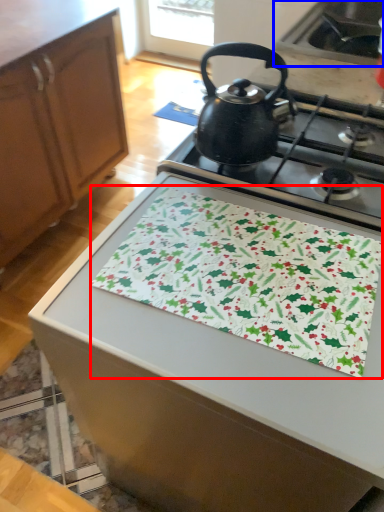
Question: Which point is further to the camera, blanket (highlighted by a red box) or sink (highlighted by a blue box)?

Choices:
 (A) blanket
 (B) sink

Answer: (B)